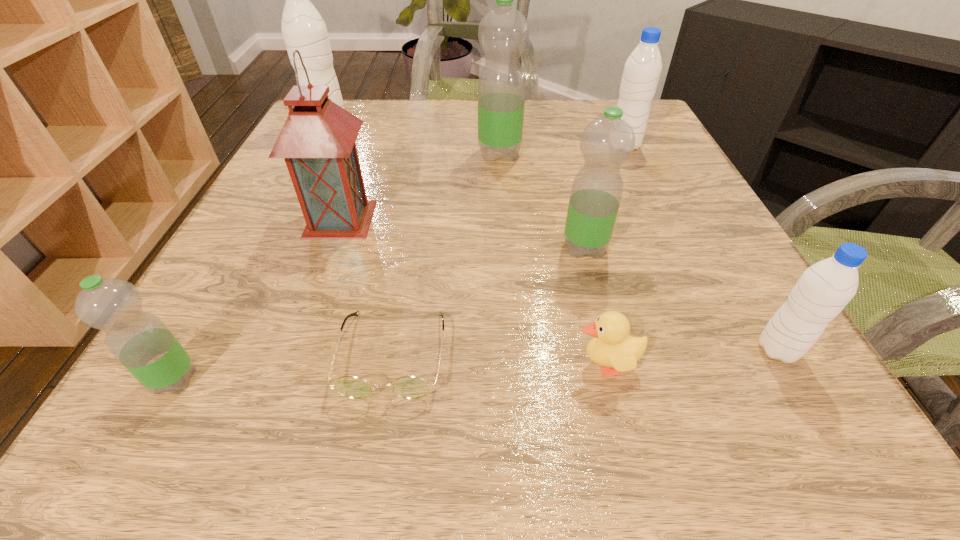
You are a GUI agent. You are given a task and a screenshot of the screen. Output one action in this format:
    pyautogui.click(x=<x>, y=<y>)
    Task: Click on the fifth object from left to right
    Image resolution: width=960 pixels, height=540 pixels.
    Given the screenshot: What is the action you would take?
    pyautogui.click(x=503, y=33)

The width and height of the screenshot is (960, 540). Find the location of `the second green water bottle from right to left`. the second green water bottle from right to left is located at coordinates (503, 33).

Locate an element on the screen. The width and height of the screenshot is (960, 540). the farthest water bottle is located at coordinates coord(303,28).

Find the location of a particular element. This screenshot has width=960, height=540. the biggest gray water bottle is located at coordinates (303, 28).

The image size is (960, 540). Find the location of `the seventh object from right to left`. the seventh object from right to left is located at coordinates (317, 141).

Image resolution: width=960 pixels, height=540 pixels. What are the coordinates of `pink lantern` in the screenshot? It's located at (317, 141).

Identify the location of the second biggest gray water bottle. Image resolution: width=960 pixels, height=540 pixels. (642, 70).

This screenshot has width=960, height=540. What are the coordinates of `the second water bottle from right to left` in the screenshot? It's located at (642, 70).

Find the location of a particular element. This screenshot has height=540, width=960. the second smallest green water bottle is located at coordinates (607, 142).

At what (x,y) coordinates should I click in order to perform the action: click on the second nearest green water bottle. Please return your answer as a coordinate pair (x, y). This screenshot has width=960, height=540. Looking at the image, I should click on (607, 142).